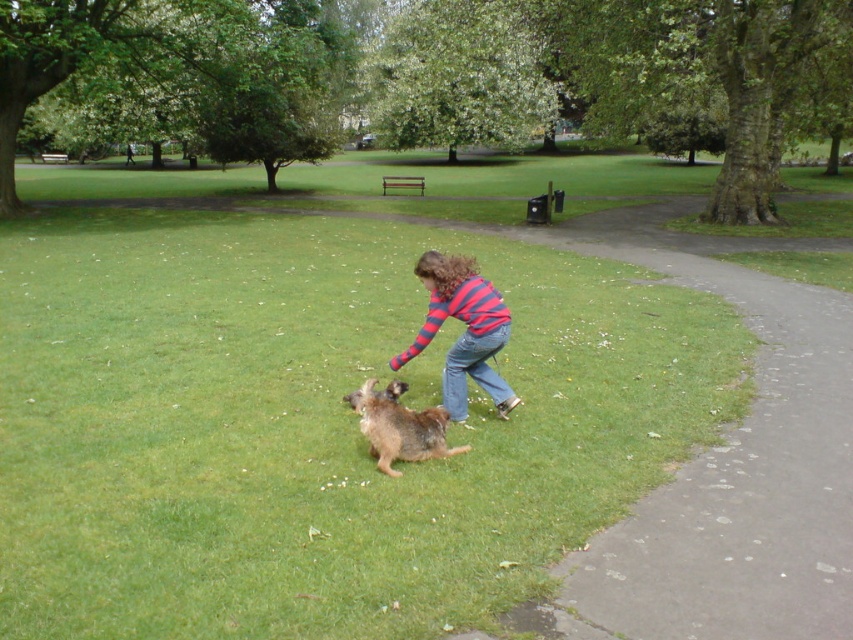
Can you confirm if striped cotton shirt at center is positioned to the left of brown shaggy dog at center?

No, striped cotton shirt at center is not to the left of brown shaggy dog at center.

Who is positioned more to the left, striped cotton shirt at center or brown shaggy dog at center?

Positioned to the left is brown shaggy dog at center.

At what (x,y) coordinates should I click in order to perform the action: click on striped cotton shirt at center. Please return your answer as a coordinate pair (x, y). The image size is (853, 640). Looking at the image, I should click on (463, 332).

Identify the location of striped cotton shirt at center. (463, 332).